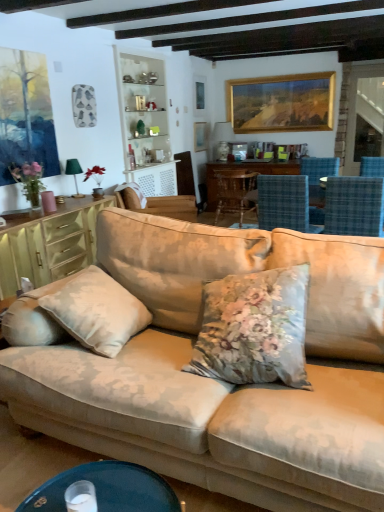
Question: From a real-world perspective, is wooden chair at center, which is the 1th chair from back to front, over matte green cabinet at left?

Choices:
 (A) no
 (B) yes

Answer: (A)

Question: Considering the relative positions of wooden chair at center, which is the 1th chair from back to front, and matte green cabinet at left in the image provided, is wooden chair at center, which is the 1th chair from back to front, behind matte green cabinet at left?

Choices:
 (A) yes
 (B) no

Answer: (A)

Question: From the image's perspective, does wooden chair at center, which is the 1th chair from back to front, appear lower than matte green cabinet at left?

Choices:
 (A) no
 (B) yes

Answer: (A)

Question: From a real-world perspective, is wooden chair at center, which appears as the fourth chair when viewed from the front, positioned under matte green cabinet at left based on gravity?

Choices:
 (A) no
 (B) yes

Answer: (B)

Question: Considering the relative positions of wooden chair at center, which appears as the fourth chair when viewed from the front, and matte green cabinet at left in the image provided, is wooden chair at center, which appears as the fourth chair when viewed from the front, to the left of matte green cabinet at left from the viewer's perspective?

Choices:
 (A) no
 (B) yes

Answer: (A)

Question: Considering the relative positions of wooden table at center and blue plaid chair at center, which ranks as the third chair in back-to-front order, in the image provided, is wooden table at center to the left or to the right of blue plaid chair at center, which ranks as the third chair in back-to-front order,?

Choices:
 (A) right
 (B) left

Answer: (A)

Question: Looking at the image, does wooden table at center seem bigger or smaller compared to blue plaid chair at center, which ranks as the third chair in back-to-front order?

Choices:
 (A) big
 (B) small

Answer: (A)

Question: In the image, is wooden table at center positioned in front of or behind blue plaid chair at center, which ranks as the third chair in back-to-front order?

Choices:
 (A) front
 (B) behind

Answer: (B)

Question: Is wooden table at center inside the boundaries of blue plaid chair at center, which ranks as the third chair in back-to-front order, or outside?

Choices:
 (A) outside
 (B) inside

Answer: (A)

Question: Considering the relative positions of beige fabric chair at center, marked as the third chair in a front-to-back arrangement, and green fabric lampshade at left in the image provided, is beige fabric chair at center, marked as the third chair in a front-to-back arrangement, to the left or to the right of green fabric lampshade at left?

Choices:
 (A) right
 (B) left

Answer: (A)

Question: Considering the positions of beige fabric chair at center, the 2th chair positioned from the back, and green fabric lampshade at left in the image, is beige fabric chair at center, the 2th chair positioned from the back, bigger or smaller than green fabric lampshade at left?

Choices:
 (A) big
 (B) small

Answer: (A)

Question: Does point (132, 205) appear closer or farther from the camera than point (77, 166)?

Choices:
 (A) closer
 (B) farther

Answer: (A)

Question: Considering the positions of beige fabric chair at center, marked as the third chair in a front-to-back arrangement, and green fabric lampshade at left in the image, is beige fabric chair at center, marked as the third chair in a front-to-back arrangement, wider or thinner than green fabric lampshade at left?

Choices:
 (A) thin
 (B) wide

Answer: (B)

Question: Is point (364, 177) closer or farther from the camera than point (210, 203)?

Choices:
 (A) farther
 (B) closer

Answer: (B)

Question: Considering the relative positions of blue plaid chair at right, acting as the 1th chair starting from the front, and wooden table at center in the image provided, is blue plaid chair at right, acting as the 1th chair starting from the front, to the left or to the right of wooden table at center?

Choices:
 (A) left
 (B) right

Answer: (B)